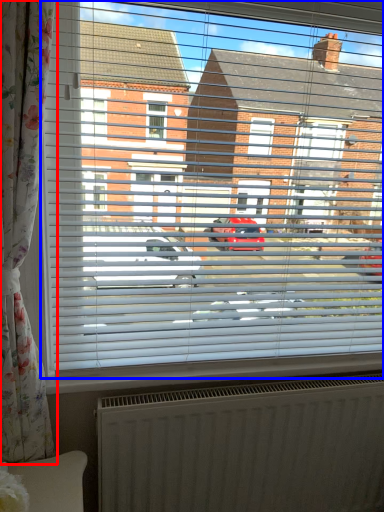
Question: Which of the following is the farthest to the observer, curtain (highlighted by a red box) or window (highlighted by a blue box)?

Choices:
 (A) curtain
 (B) window

Answer: (B)